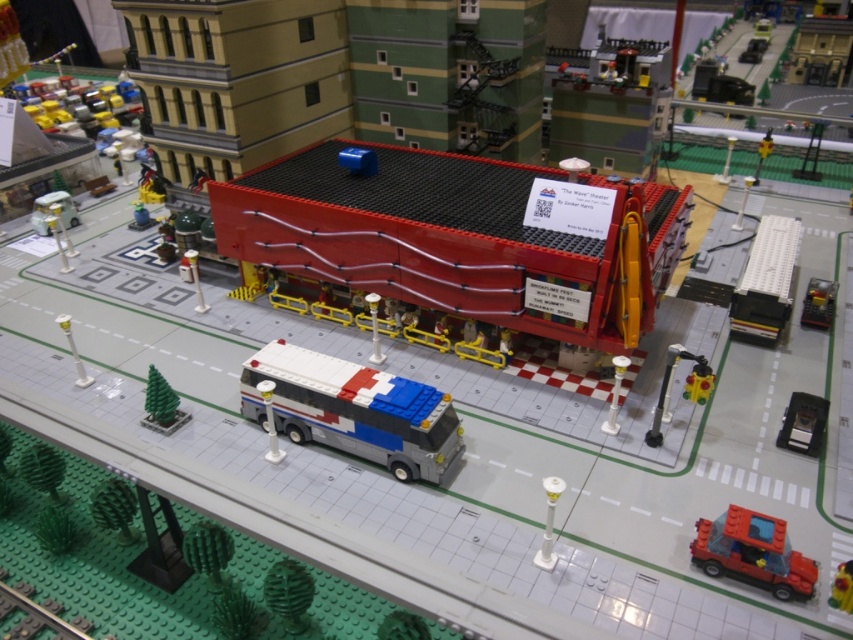
You are a Lego figure standing at the base of the green rubber tree at lower left. You want to climb up to the top of the smooth red theater at center. Is the height difference between them significant enough to require a ladder or stairs?

The smooth red theater at center is much taller than the green rubber tree at lower left, so yes, the height difference is significant enough to require a ladder or stairs to climb up.

You are a Lego figure standing at the entrance of The Wave Theater. You want to water both the green rubber plant at lower center and the green rubber tree at lower left. Which one should you water first if you want to follow the watering schedule starting from the closest plant to the farthest?

The green rubber plant at lower center is in front of the green rubber tree at lower left, so you should water the green rubber plant at lower center first as it is closer to you.

Consider the image. You are a delivery drone flying over a Lego city scene. You need to land precisely at the green rubber plant at lower center. What are the coordinates where you should aim to land?

The green rubber plant at lower center is located at coordinates point (x=288, y=593). Aim for those coordinates to land precisely.